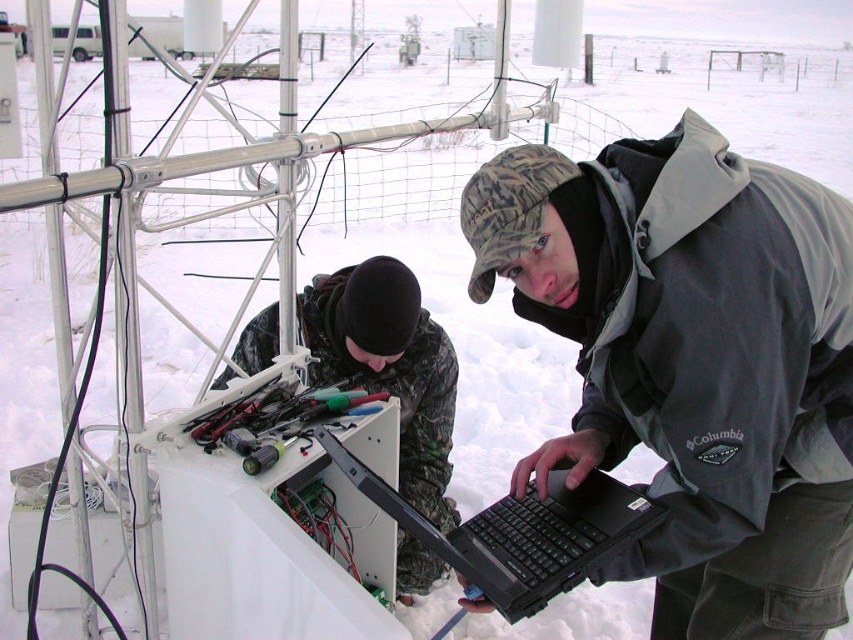
Does camouflage fabric jacket at lower center appear over black matte laptop at center?

Actually, camouflage fabric jacket at lower center is below black matte laptop at center.

Is camouflage fabric jacket at lower center to the right of black matte laptop at center from the viewer's perspective?

Incorrect, camouflage fabric jacket at lower center is not on the right side of black matte laptop at center.

The width and height of the screenshot is (853, 640). Describe the element at coordinates (387, 365) in the screenshot. I see `camouflage fabric jacket at lower center` at that location.

The image size is (853, 640). Identify the location of camouflage fabric jacket at lower center. (387, 365).

Between point (339, 276) and point (303, 426), which one is positioned in front?

Point (303, 426) is more forward.

Who is higher up, camouflage fabric jacket at lower center or metallic tools at center?

Positioned higher is metallic tools at center.

This screenshot has height=640, width=853. Find the location of `camouflage fabric jacket at lower center`. camouflage fabric jacket at lower center is located at coordinates (387, 365).

Does point (816, 252) lie in front of point (242, 445)?

Yes, it is in front of point (242, 445).

Who is more distant from viewer, (769,627) or (378,392)?

The point (378,392) is behind.

Locate an element on the screen. Image resolution: width=853 pixels, height=640 pixels. gray softshell jacket at center is located at coordinates (693, 362).